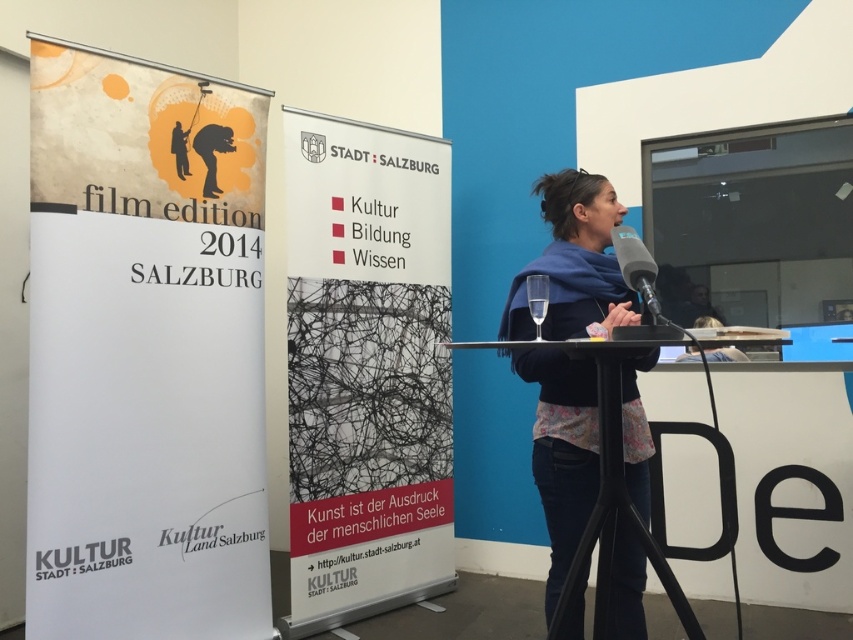
What is the material of the object located at point [144,352]?

The object at point [144,352] is made of matte paper.

You are organizing a gallery event and need to hang the matte paper poster at left and the black fabric scarf at center on a wall. Based on their sizes, which object should be placed higher to ensure both are visible without overlapping?

The matte paper poster at left is larger than the black fabric scarf at center, so placing the poster higher will allow both to be visible without overlapping.